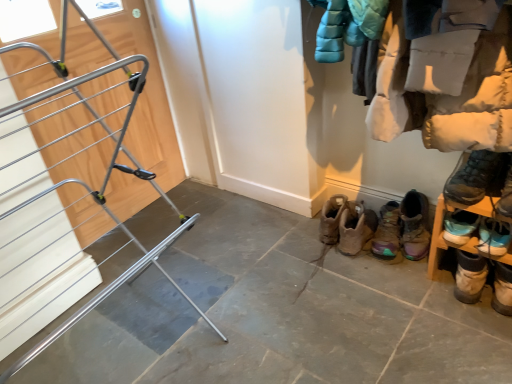
The height and width of the screenshot is (384, 512). Identify the location of free space above wooden shoe rack at lower right (from a real-world perspective). (492, 198).